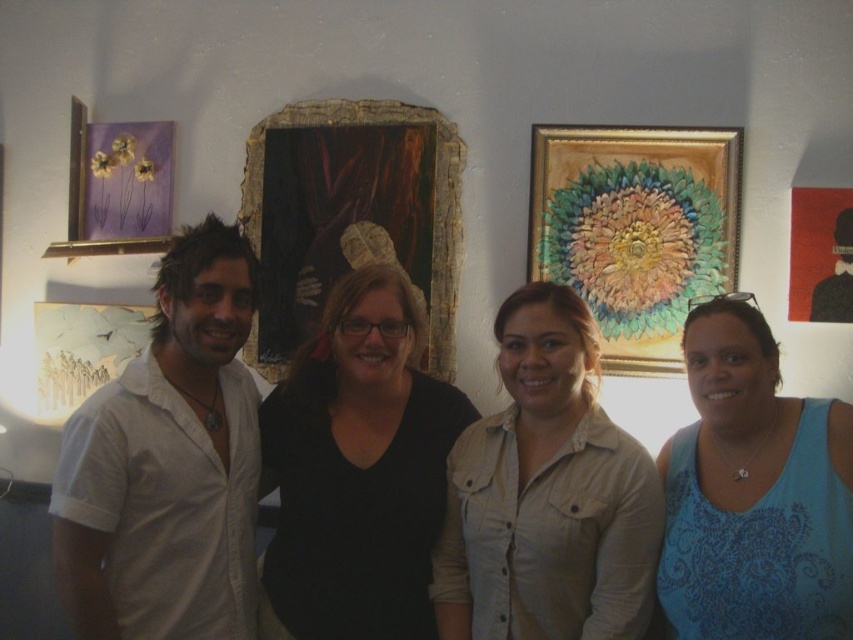
Does beige button-up shirt at center have a smaller size compared to gold textured painting at upper center?

No, beige button-up shirt at center is not smaller than gold textured painting at upper center.

Is point (598, 572) farther from camera compared to point (596, 132)?

No, it is in front of (596, 132).

The height and width of the screenshot is (640, 853). I want to click on beige button-up shirt at center, so click(547, 493).

Image resolution: width=853 pixels, height=640 pixels. I want to click on beige button-up shirt at center, so click(x=547, y=493).

Does white cotton shirt at left have a smaller size compared to blue printed tank top at right?

No, white cotton shirt at left is not smaller than blue printed tank top at right.

Which is behind, point (86, 552) or point (688, 518)?

The point (688, 518) is behind.

Locate an element on the screen. The image size is (853, 640). white cotton shirt at left is located at coordinates (167, 464).

Is point (726, 374) farther from viewer compared to point (646, 248)?

No, (726, 374) is in front of (646, 248).

Can you confirm if blue printed tank top at right is positioned to the right of gold textured painting at upper center?

In fact, blue printed tank top at right is to the left of gold textured painting at upper center.

Between point (672, 436) and point (605, 141), which one is positioned behind?

Positioned behind is point (605, 141).

The image size is (853, 640). I want to click on blue printed tank top at right, so click(753, 493).